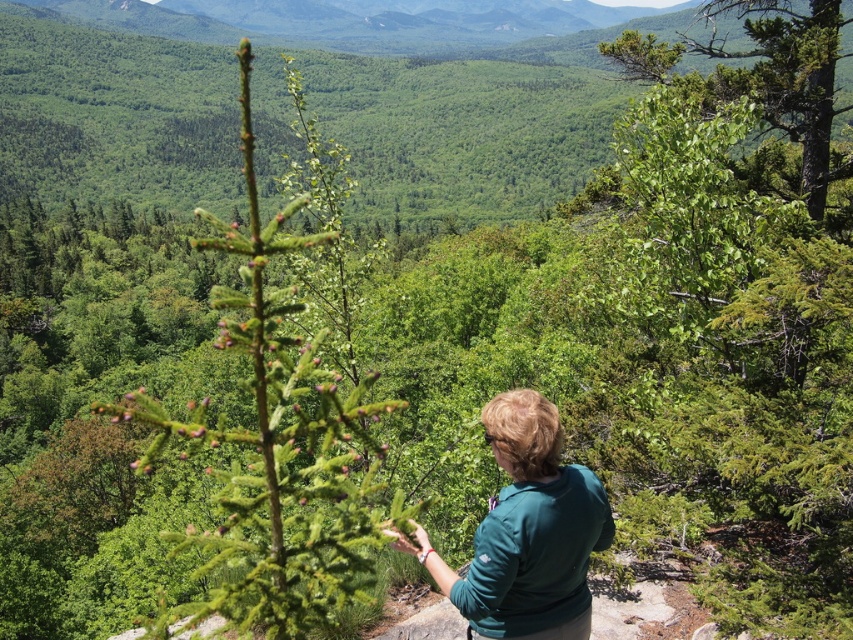
Can you confirm if green matte shirt at center is wider than green leafy tree at upper right?

No, green matte shirt at center is not wider than green leafy tree at upper right.

Does green matte shirt at center appear under green leafy tree at upper right?

Indeed, green matte shirt at center is positioned under green leafy tree at upper right.

Who is more forward, (560, 625) or (624, 29)?

Point (560, 625) is in front.

The width and height of the screenshot is (853, 640). Find the location of `green matte shirt at center`. green matte shirt at center is located at coordinates (527, 531).

Does green needle-like at center appear on the right side of green matte shirt at center?

In fact, green needle-like at center is to the left of green matte shirt at center.

Who is higher up, green needle-like at center or green matte shirt at center?

green needle-like at center

What do you see at coordinates (277, 448) in the screenshot?
I see `green needle-like at center` at bounding box center [277, 448].

Locate an element on the screen. This screenshot has height=640, width=853. green needle-like at center is located at coordinates (277, 448).

Is point (221, 532) in front of point (753, 12)?

Yes, point (221, 532) is closer to viewer.

Is green needle-like at center below green leafy tree at upper right?

Indeed, green needle-like at center is positioned under green leafy tree at upper right.

Which is in front, point (276, 317) or point (808, 22)?

Point (276, 317) is more forward.

This screenshot has width=853, height=640. I want to click on green needle-like at center, so pyautogui.click(x=277, y=448).